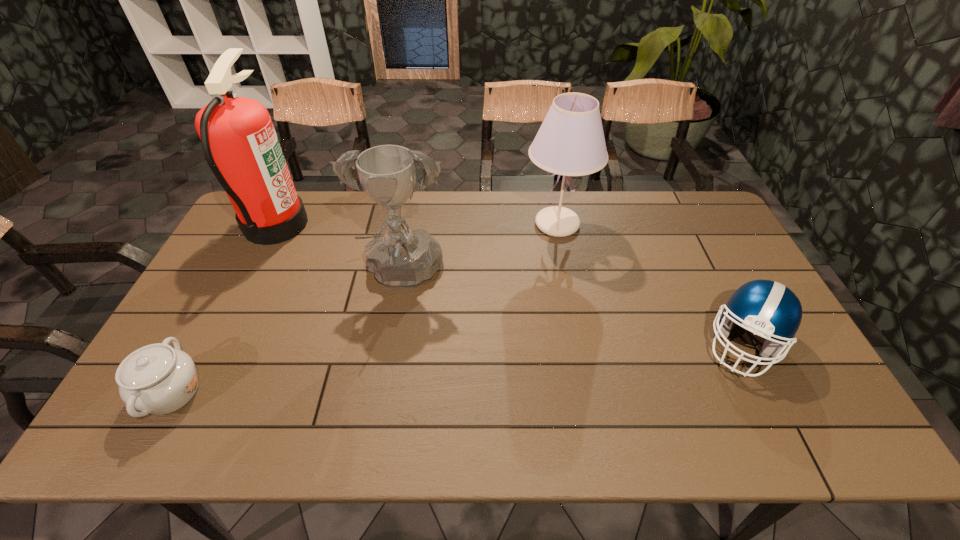
Identify the location of free region at the near edge of the desktop. (331, 423).

You are a GUI agent. You are given a task and a screenshot of the screen. Output one action in this format:
    pyautogui.click(x=<x>, y=<y>)
    Task: Click on the free space at the left edge of the desktop
    
    Given the screenshot: What is the action you would take?
    pyautogui.click(x=216, y=367)

In the image, there is a desktop. Identify the location of free space at the right edge. (681, 241).

Locate an element on the screen. free space at the near left corner of the desktop is located at coordinates (109, 440).

The height and width of the screenshot is (540, 960). What are the coordinates of `free point between the rightmost object and the fire extinguisher` in the screenshot? It's located at (510, 284).

Identify the location of vacant point located between the football helmet and the fire extinguisher. Image resolution: width=960 pixels, height=540 pixels. point(510,284).

Identify the location of free area in between the lampshade and the award. This screenshot has height=540, width=960. (480, 251).

Where is `free spot between the fire extinguisher and the rightmost object`? The width and height of the screenshot is (960, 540). free spot between the fire extinguisher and the rightmost object is located at coordinates (510, 284).

Locate an element on the screen. vacant point located between the football helmet and the second object from right to left is located at coordinates tap(650, 284).

Identify the location of vacant area between the second object from right to left and the football helmet. The height and width of the screenshot is (540, 960). (650, 284).